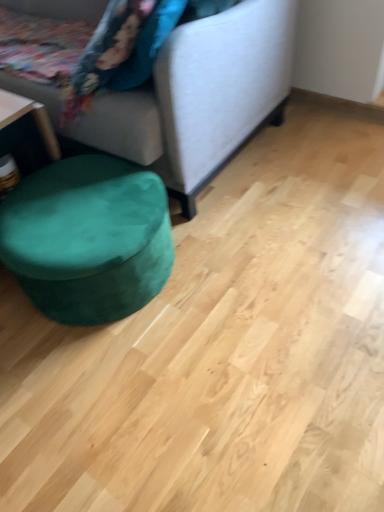
Question: Is velvet fabric studio couch at lower left further to the viewer compared to velvet green ottoman at lower left?

Choices:
 (A) no
 (B) yes

Answer: (A)

Question: From the image's perspective, is velvet fabric studio couch at lower left located beneath velvet green ottoman at lower left?

Choices:
 (A) yes
 (B) no

Answer: (B)

Question: Is velvet fabric studio couch at lower left bigger than velvet green ottoman at lower left?

Choices:
 (A) yes
 (B) no

Answer: (A)

Question: Is velvet fabric studio couch at lower left at the left side of velvet green ottoman at lower left?

Choices:
 (A) yes
 (B) no

Answer: (A)

Question: Does velvet fabric studio couch at lower left have a lesser height compared to velvet green ottoman at lower left?

Choices:
 (A) no
 (B) yes

Answer: (A)

Question: Could you tell me if velvet fabric studio couch at lower left is turned towards velvet green ottoman at lower left?

Choices:
 (A) yes
 (B) no

Answer: (A)

Question: Is velvet green ottoman at lower left smaller than velvet fabric studio couch at lower left?

Choices:
 (A) no
 (B) yes

Answer: (B)

Question: Is velvet green ottoman at lower left located outside velvet fabric studio couch at lower left?

Choices:
 (A) no
 (B) yes

Answer: (B)

Question: Considering the relative sizes of velvet green ottoman at lower left and velvet fabric studio couch at lower left in the image provided, is velvet green ottoman at lower left thinner than velvet fabric studio couch at lower left?

Choices:
 (A) no
 (B) yes

Answer: (B)

Question: Would you consider velvet green ottoman at lower left to be distant from velvet fabric studio couch at lower left?

Choices:
 (A) no
 (B) yes

Answer: (A)

Question: From a real-world perspective, is velvet green ottoman at lower left on velvet fabric studio couch at lower left?

Choices:
 (A) yes
 (B) no

Answer: (B)

Question: Is velvet green ottoman at lower left oriented towards velvet fabric studio couch at lower left?

Choices:
 (A) no
 (B) yes

Answer: (A)

Question: In terms of width, does velvet fabric studio couch at lower left look wider or thinner when compared to velvet green ottoman at lower left?

Choices:
 (A) thin
 (B) wide

Answer: (B)